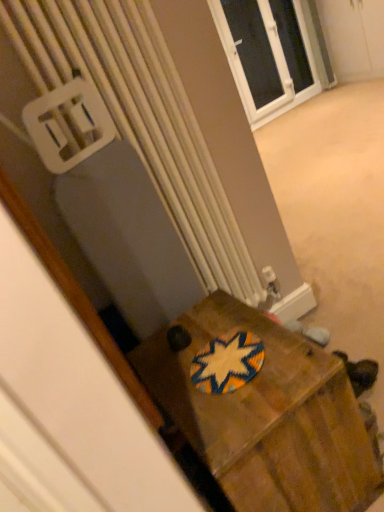
Image resolution: width=384 pixels, height=512 pixels. What are the coordinates of `vacant space situated above woven fabric coaster at center (from a real-world perspective)` in the screenshot? It's located at (224, 355).